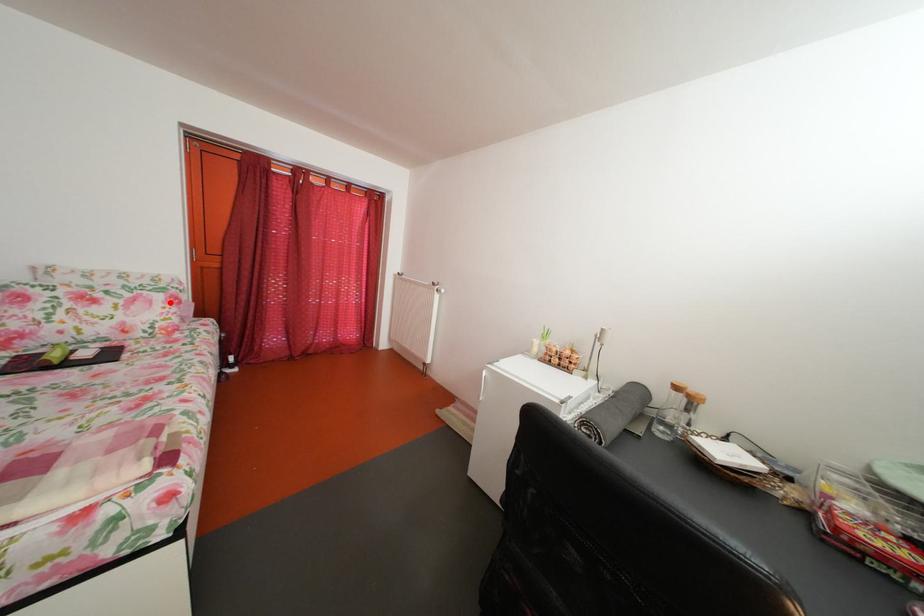
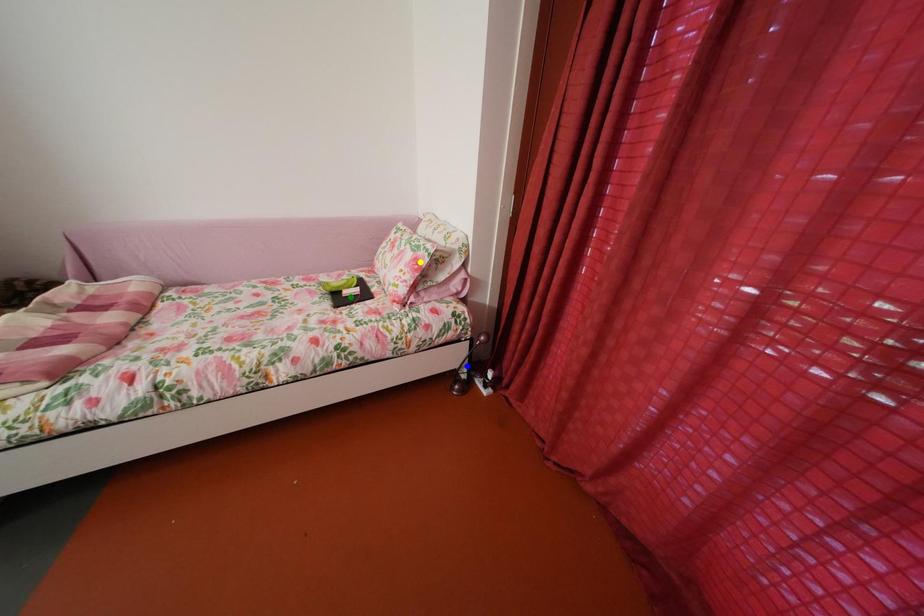
Question: I am providing you with two images of the same scene from different viewpoints. A red point is marked on the first image. You are given multiple points on the second image. Can you choose the point in image 2 that corresponds to the point in image 1?

Choices:
 (A) blue point
 (B) yellow point
 (C) green point

Answer: (B)